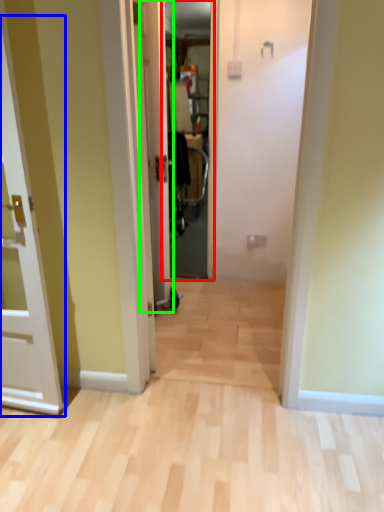
Question: Estimate the real-world distances between objects in this image. Which object is closer to screen door (highlighted by a red box), door (highlighted by a blue box) or door (highlighted by a green box)?

Choices:
 (A) door
 (B) door

Answer: (B)